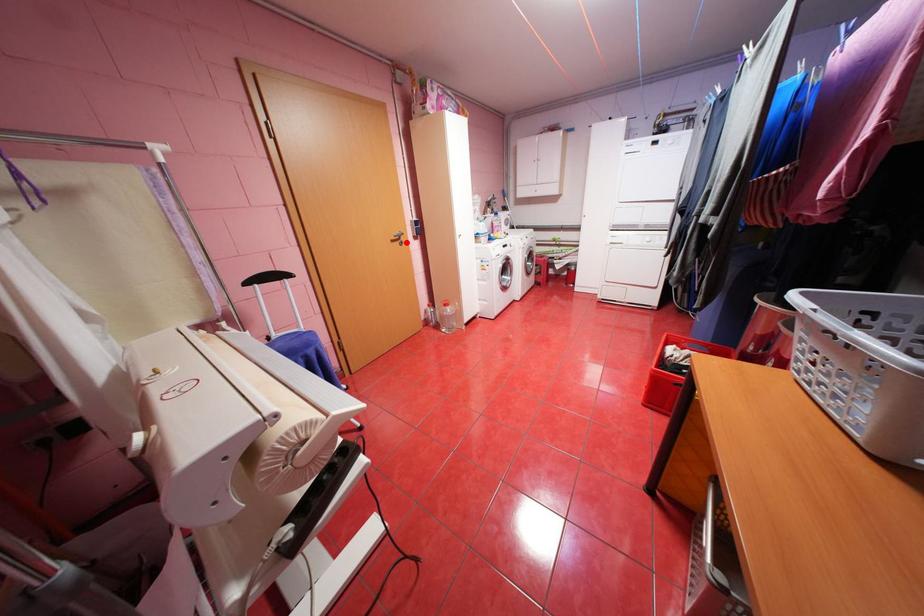
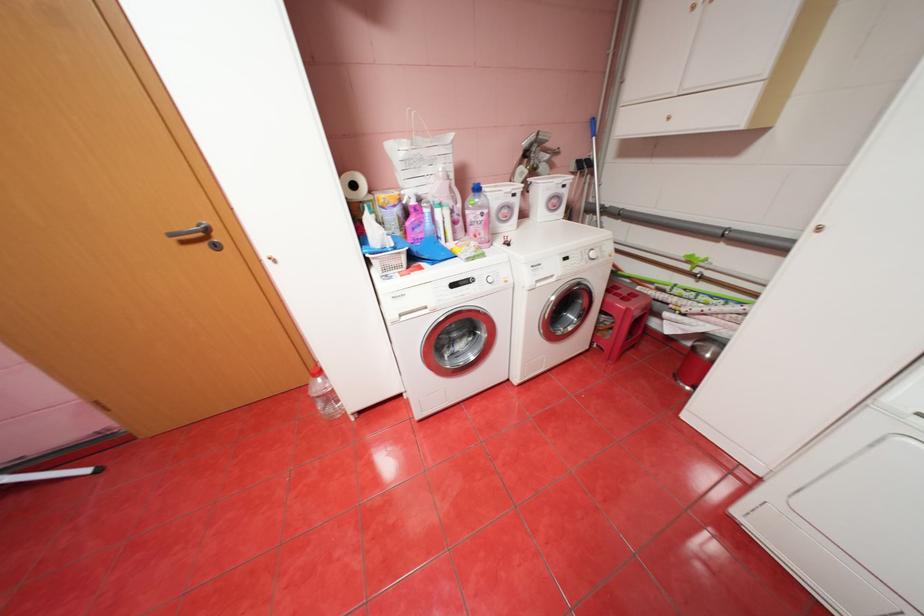
In the second image, find the point that corresponds to the highlighted location in the first image.

(213, 245)